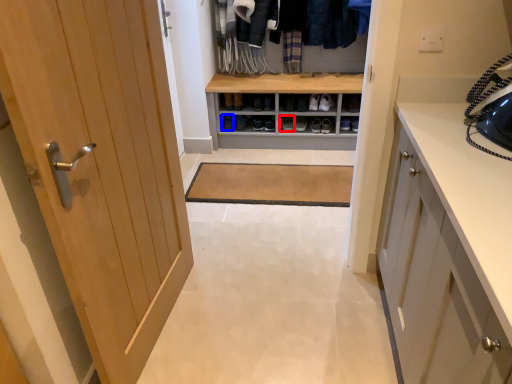
Question: Which of the following is the farthest to the observer, footwear (highlighted by a red box) or shoe (highlighted by a blue box)?

Choices:
 (A) footwear
 (B) shoe

Answer: (B)